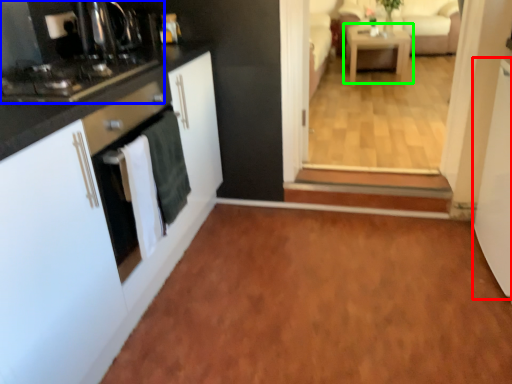
Question: Which is nearer to the screen door (highlighted by a red box)? home appliance (highlighted by a blue box) or table (highlighted by a green box).

Choices:
 (A) home appliance
 (B) table

Answer: (A)